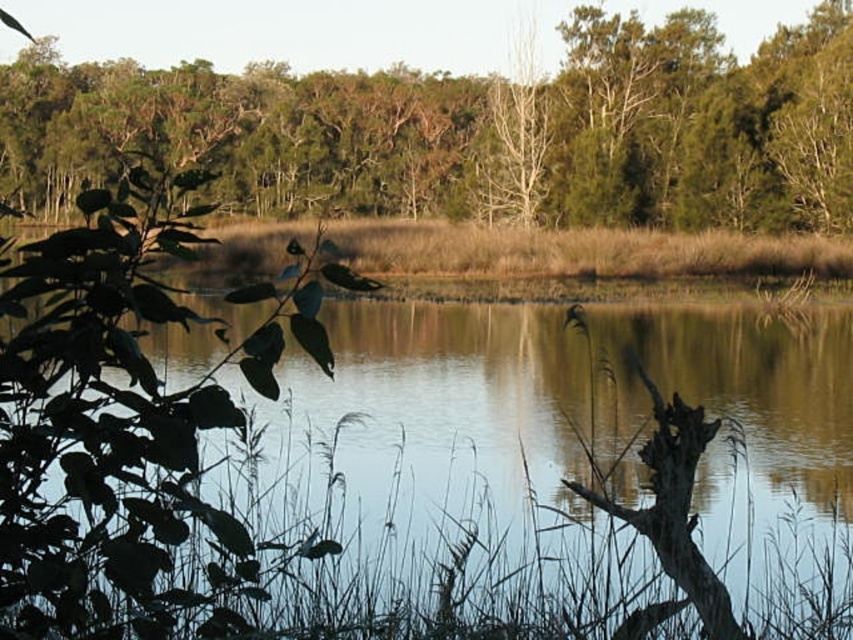
Question: Is green grass at lower left to the left of green leafy tree at upper center from the viewer's perspective?

Choices:
 (A) yes
 (B) no

Answer: (B)

Question: Among these objects, which one is farthest from the camera?

Choices:
 (A) green grass at lower left
 (B) green leafy tree at upper center

Answer: (B)

Question: Does green grass at lower left have a lesser width compared to green leafy tree at upper center?

Choices:
 (A) yes
 (B) no

Answer: (A)

Question: Does green grass at lower left appear over green leafy tree at upper center?

Choices:
 (A) yes
 (B) no

Answer: (B)